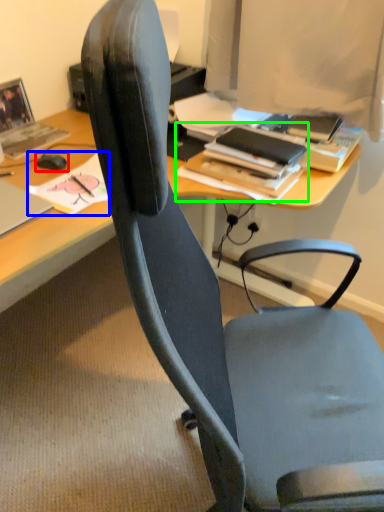
Question: Considering the real-world distances, which object is closest to mouse (highlighted by a red box)? book (highlighted by a blue box) or book (highlighted by a green box).

Choices:
 (A) book
 (B) book

Answer: (A)